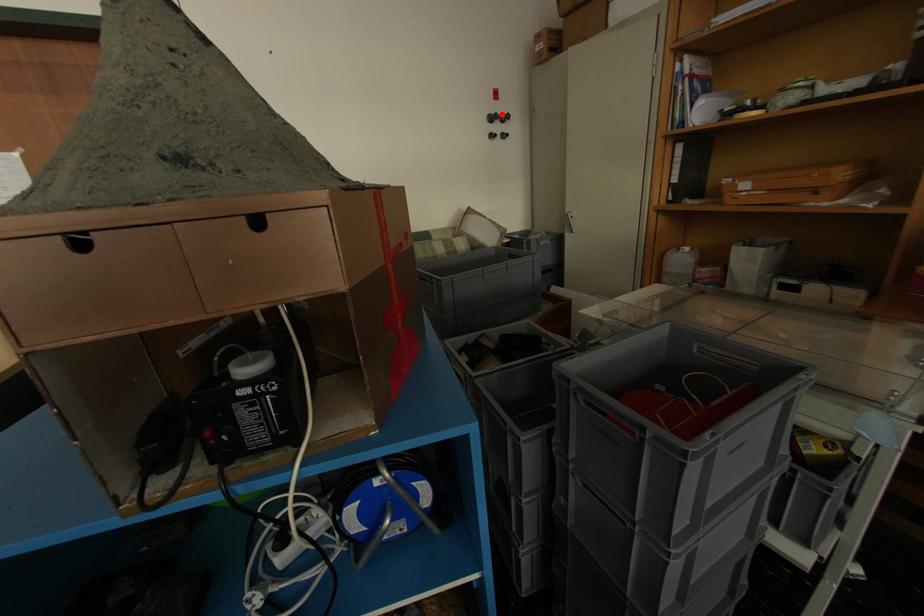
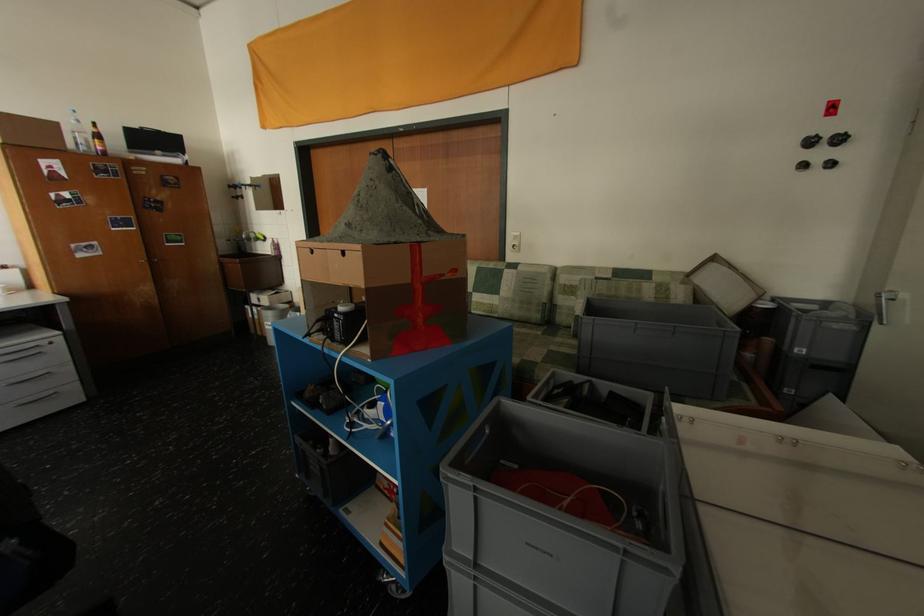
Question: A red point is marked in image1. In image2, is the corresponding 3D point closer to the camera or farther? Reply with the corresponding letter.

Choices:
 (A) The corresponding 3D point is closer.
 (B) The corresponding 3D point is farther.

Answer: (B)